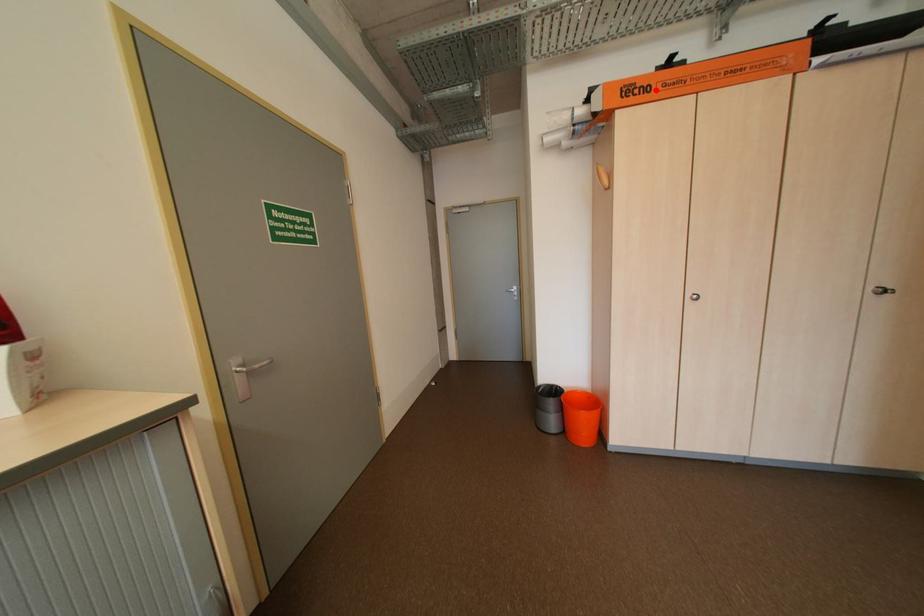
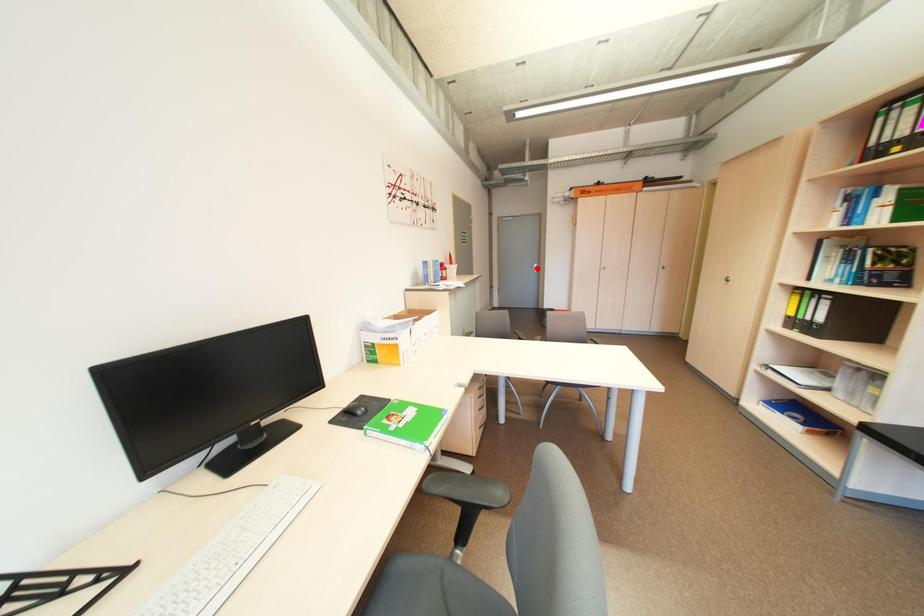
I am providing you with two images of the same scene from different viewpoints. A red point is marked on the first image and another point is marked on the second image. Does the point marked in image1 correspond to the same location as the one in image2?

No